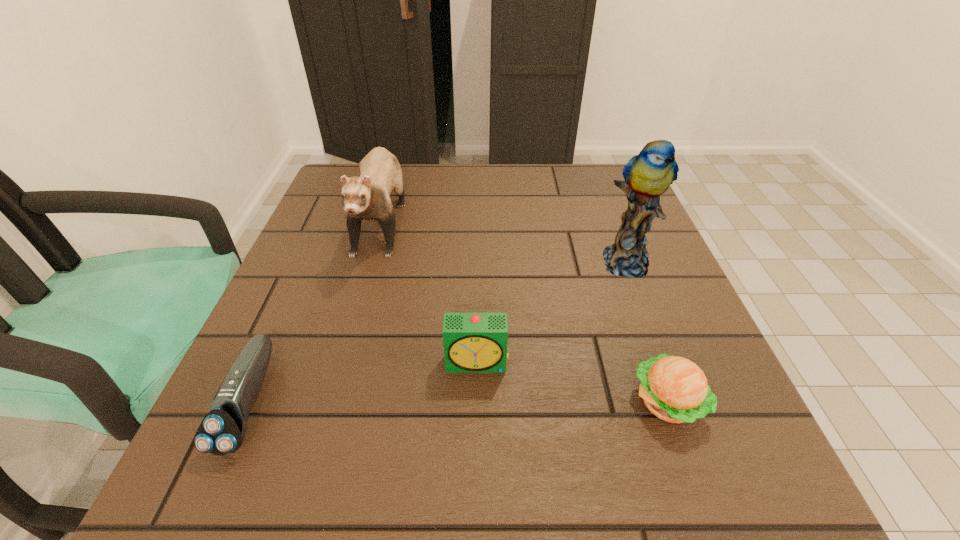
Locate an element on the screen. This screenshot has width=960, height=540. blank space located on the front-facing side of the alarm clock is located at coordinates (476, 450).

Locate an element on the screen. This screenshot has width=960, height=540. free space located 0.360m on the back of the hamburger is located at coordinates (609, 238).

The width and height of the screenshot is (960, 540). What are the coordinates of `object present at the far edge` in the screenshot? It's located at (367, 197).

Identify the location of object located at the near edge. The image size is (960, 540). (222, 430).

Find the location of a particular element. The width and height of the screenshot is (960, 540). ferret that is at the left edge is located at coordinates click(x=367, y=197).

Where is `electric shaver that is at the left edge`? electric shaver that is at the left edge is located at coordinates (222, 430).

You are a GUI agent. You are given a task and a screenshot of the screen. Output one action in this format:
    pyautogui.click(x=<x>, y=<y>)
    Task: Click on the parrot located in the right edge section of the desktop
    
    Given the screenshot: What is the action you would take?
    pyautogui.click(x=647, y=175)

Where is `hamburger positioned at the right edge`? hamburger positioned at the right edge is located at coordinates (674, 389).

You are a GUI agent. You are given a task and a screenshot of the screen. Output one action in this format:
    pyautogui.click(x=<x>, y=<y>)
    Task: Click on the object that is positioned at the far left corner
    The width and height of the screenshot is (960, 540).
    Given the screenshot: What is the action you would take?
    pyautogui.click(x=367, y=197)

Where is `object at the near left corner`? Image resolution: width=960 pixels, height=540 pixels. object at the near left corner is located at coordinates (222, 430).